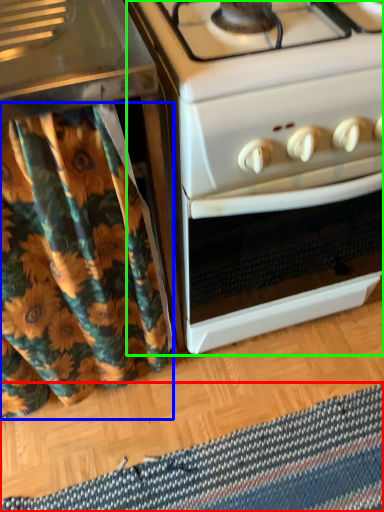
Question: Which object is the closest to the mat (highlighted by a red box)? Choose among these: shower curtain (highlighted by a blue box) or oven (highlighted by a green box).

Choices:
 (A) shower curtain
 (B) oven

Answer: (A)